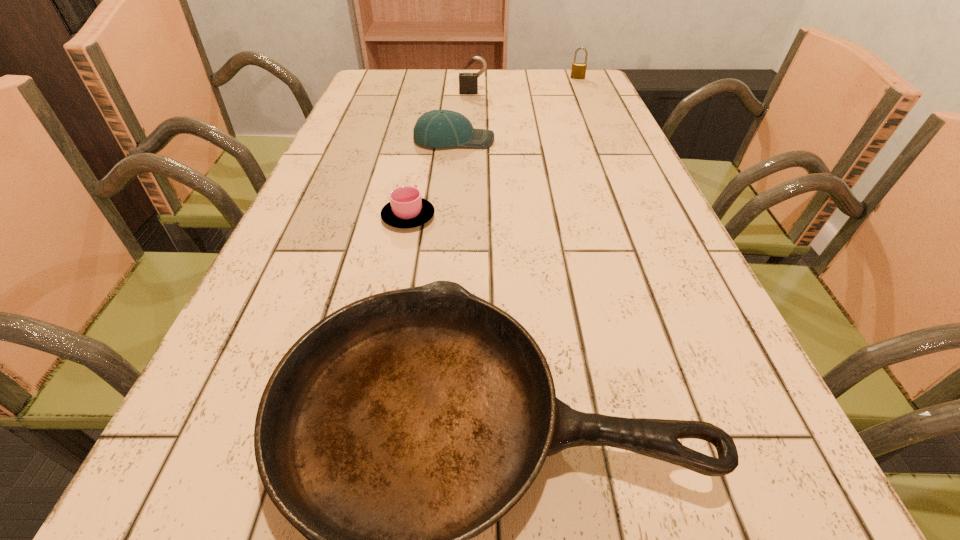
Image resolution: width=960 pixels, height=540 pixels. I want to click on empty space between the shortest object and the baseball cap, so click(x=431, y=179).

The height and width of the screenshot is (540, 960). I want to click on vacant space that is in between the fourth farthest object and the third farthest object, so click(x=431, y=179).

Select which object is the fourth closest to the fourth farthest object. Please provide its 2D coordinates. Your answer should be formatted as a tuple, i.e. [(x, y)], where the tuple contains the x and y coordinates of a point satisfying the conditions above.

[(578, 71)]

Choose which object is the second nearest neighbor to the right padlock. Please provide its 2D coordinates. Your answer should be formatted as a tuple, i.e. [(x, y)], where the tuple contains the x and y coordinates of a point satisfying the conditions above.

[(438, 128)]

The height and width of the screenshot is (540, 960). Identify the location of free spot that satisfies the following two spatial constraints: 1. on the side with the handle of the rightmost object; 2. on the left side of the shortest object. (436, 78).

The image size is (960, 540). I want to click on vacant position in the image that satisfies the following two spatial constraints: 1. on the side with the handle of the baseball cap; 2. on the left side of the shortest object, so point(423,140).

Find the location of a particular element. This screenshot has height=540, width=960. free space that satisfies the following two spatial constraints: 1. on the side with the handle of the third nearest object; 2. on the left side of the second nearest object is located at coordinates (423, 140).